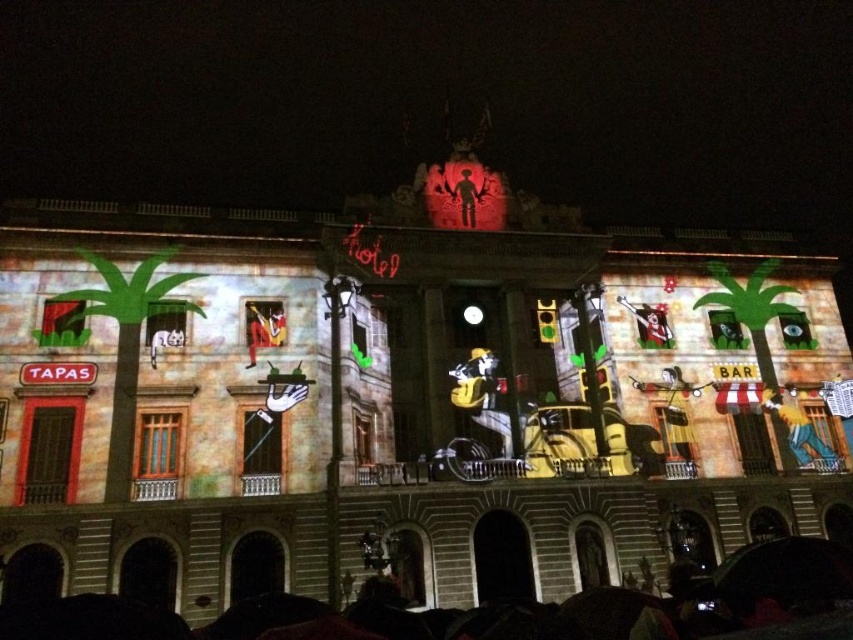
Between point (798, 464) and point (462, 188), which one is positioned behind?

The point (462, 188) is more distant.

Find the location of a particular element. blue fabric person at lower right is located at coordinates (799, 433).